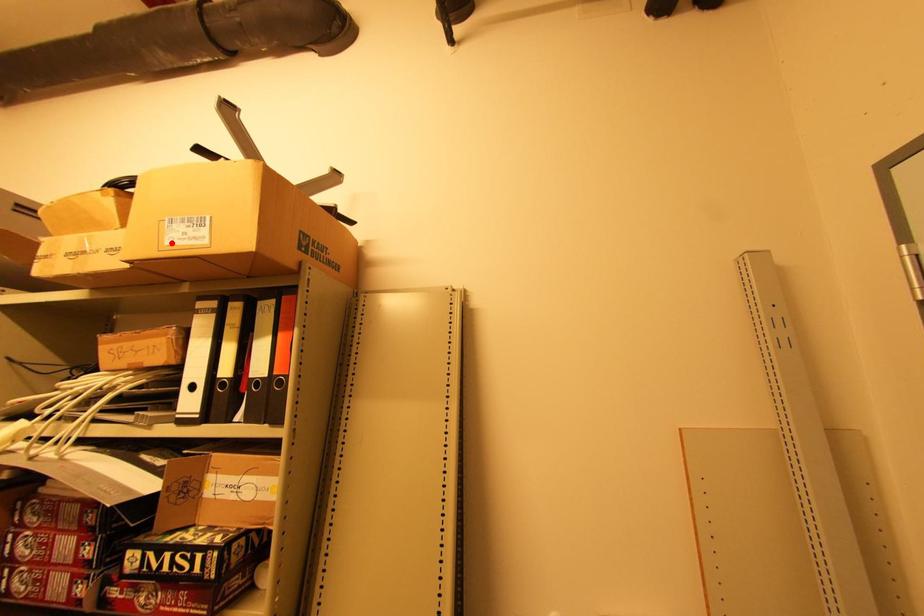
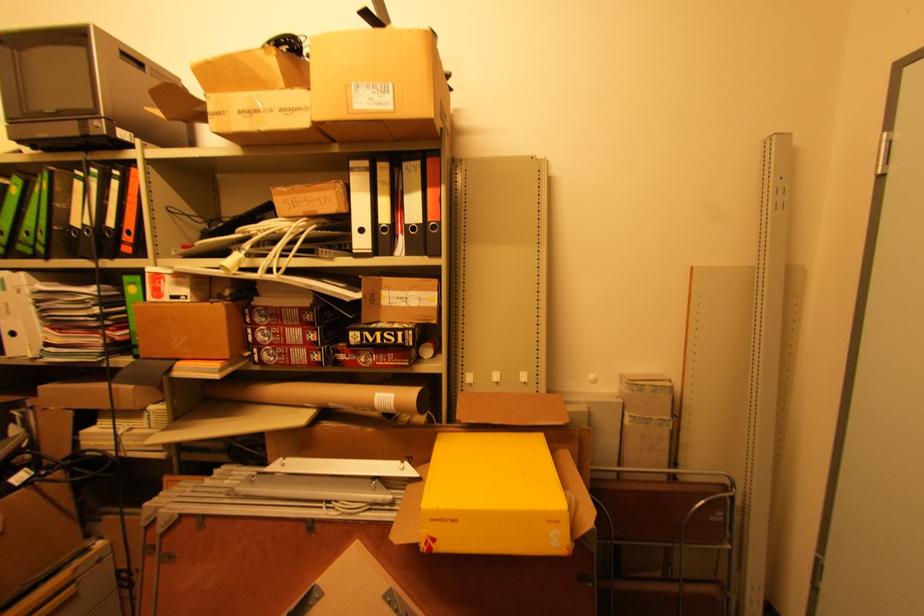
The point at the highlighted location is marked in the first image. Where is the corresponding point in the second image?

(359, 107)